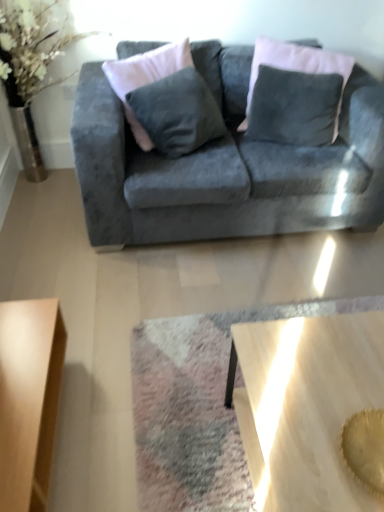
This screenshot has width=384, height=512. What are the coordinates of `vacant area that lies between velvet gray couch at center and wooden polished coffee table at lower center, arranged as the second coffee table when viewed from the left` in the screenshot? It's located at (230, 302).